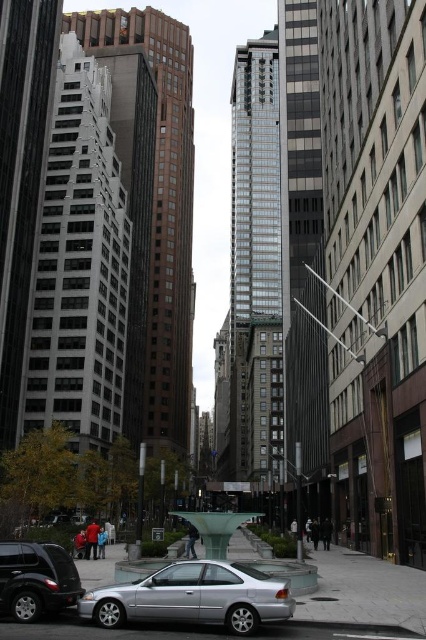
You are a pedestrian standing at the edge of the street looking towards the buildings. You see a silver metallic car at lower left and a shiny black suv at lower left. Which vehicle is closer to the fountain in the center?

The silver metallic car at lower left is closer to the fountain in the center because it is positioned below the shiny black suv at lower left, meaning it is nearer to the observer.

You are a pedestrian standing on the sidewalk and want to cross the street to the green fountain in the center. There are two vehicles in your path, a silver metallic car at lower left and a shiny black suv at lower left. Which vehicle is closer to you so you can decide the safest path to cross?

The silver metallic car at lower left is closer to the viewer than the shiny black suv at lower left, so you should cross carefully around the silver metallic car at lower left first.

You are standing at the fountain in the center of the street. You see two points marked on the buildings around you. Which point, point (256, 614) or point (43, 548), is closer to you?

Point (256, 614) is closer to you than point (43, 548).